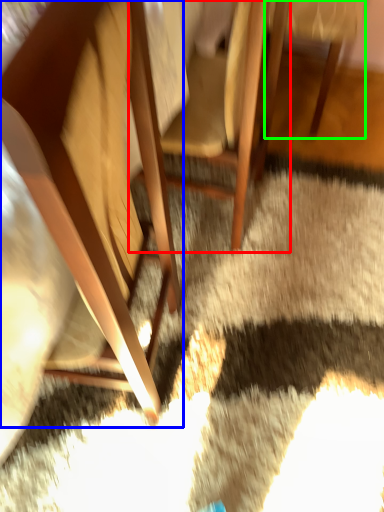
Question: Considering the real-world distances, which object is farthest from chair (highlighted by a red box)? chair (highlighted by a blue box) or chair (highlighted by a green box)?

Choices:
 (A) chair
 (B) chair

Answer: (A)